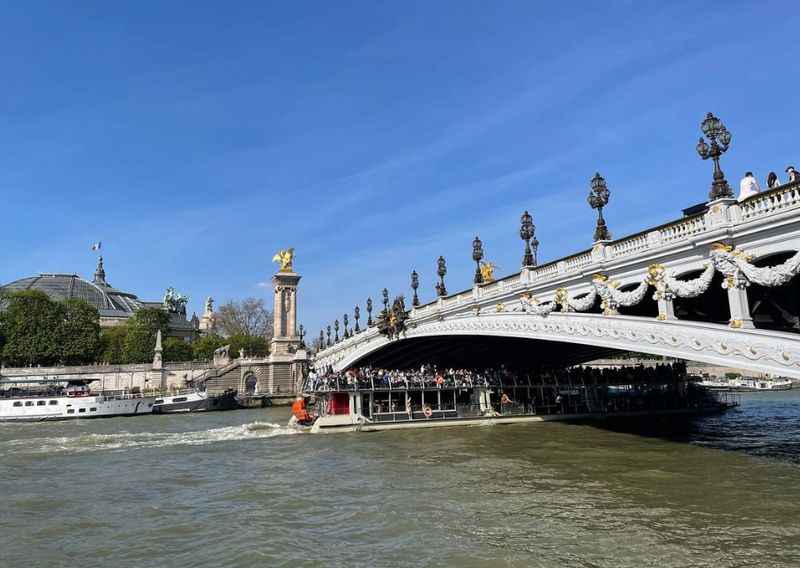
Image resolution: width=800 pixels, height=568 pixels. I want to click on stairs, so click(210, 375).